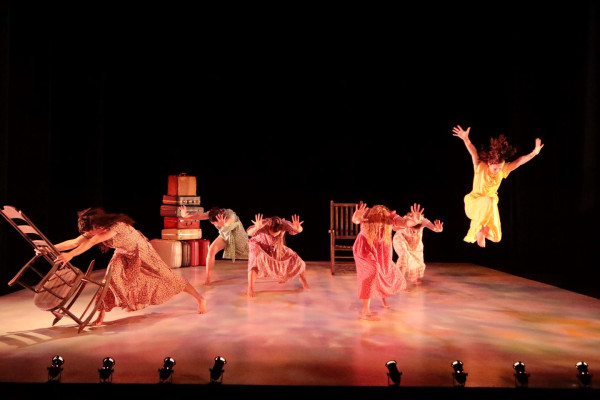
The height and width of the screenshot is (400, 600). In order to click on rocking chair in this screenshot , I will do `click(83, 301)`.